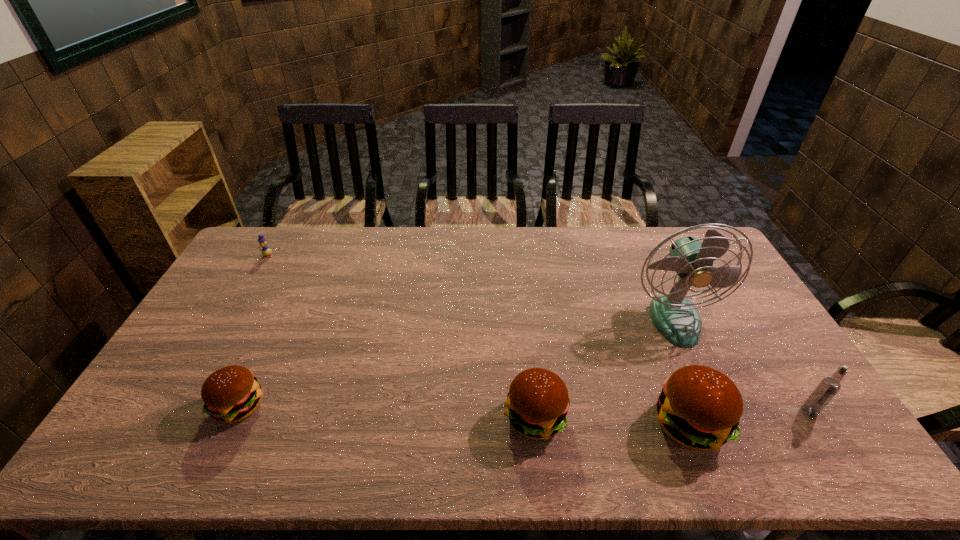
The image size is (960, 540). In order to click on vacant area that lies between the leftmost object and the rightmost object in this screenshot , I will do `click(539, 334)`.

You are a GUI agent. You are given a task and a screenshot of the screen. Output one action in this format:
    pyautogui.click(x=<x>, y=<y>)
    Task: Click on the vacant space in between the shortest hamburger and the farthest object
    Image resolution: width=960 pixels, height=540 pixels.
    Given the screenshot: What is the action you would take?
    pyautogui.click(x=253, y=331)

Locate an element on the screen. free area in between the second tallest hamburger and the leftmost object is located at coordinates (401, 337).

Image resolution: width=960 pixels, height=540 pixels. In order to click on empty space that is in between the tallest object and the vodka in this screenshot , I will do `click(741, 365)`.

Locate which object is the fifth closest to the vodka. Please provide its 2D coordinates. Your answer should be formatted as a tuple, i.e. [(x, y)], where the tuple contains the x and y coordinates of a point satisfying the conditions above.

[(265, 251)]

Locate an element on the screen. object that can be found as the second closest to the second farthest object is located at coordinates (829, 386).

The width and height of the screenshot is (960, 540). In order to click on the second closest hamburger to the tallest object in this screenshot , I will do tap(537, 404).

Locate which hamburger is the second closest to the leftmost hamburger. Please provide its 2D coordinates. Your answer should be formatted as a tuple, i.e. [(x, y)], where the tuple contains the x and y coordinates of a point satisfying the conditions above.

[(699, 407)]

Identify the location of free space that satisfies the following two spatial constraints: 1. on the face of the second object from left to right, where the monocle is placed; 2. on the right side of the duckling. (180, 406).